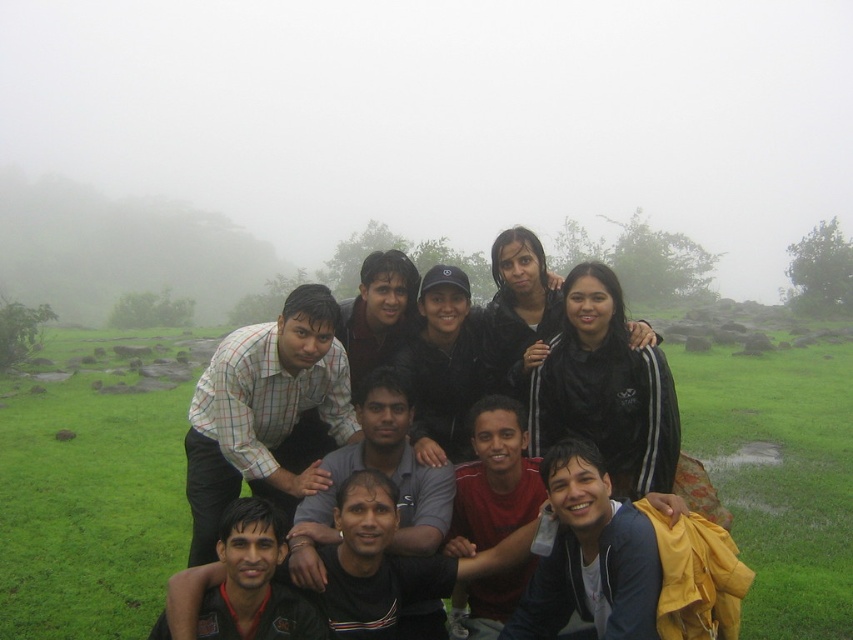
Looking at this image, is green grass at lower center to the right of foggy misty mountain at upper left from the viewer's perspective?

Correct, you'll find green grass at lower center to the right of foggy misty mountain at upper left.

Does green grass at lower center have a larger size compared to foggy misty mountain at upper left?

No.

Locate an element on the screen. green grass at lower center is located at coordinates (88, 508).

This screenshot has width=853, height=640. What are the coordinates of `green grass at lower center` in the screenshot? It's located at (88, 508).

Is green grass at lower center thinner than white checkered shirt at center?

Incorrect, green grass at lower center's width is not less than white checkered shirt at center's.

Find the location of a particular element. green grass at lower center is located at coordinates (88, 508).

I want to click on green grass at lower center, so click(x=88, y=508).

Between foggy misty mountain at upper left and white checkered shirt at center, which one appears on the left side from the viewer's perspective?

Positioned to the left is foggy misty mountain at upper left.

Is foggy misty mountain at upper left smaller than white checkered shirt at center?

No, foggy misty mountain at upper left is not smaller than white checkered shirt at center.

Is point (193, 282) behind point (271, 420)?

Yes, point (193, 282) is behind point (271, 420).

Identify the location of foggy misty mountain at upper left. This screenshot has height=640, width=853. (120, 250).